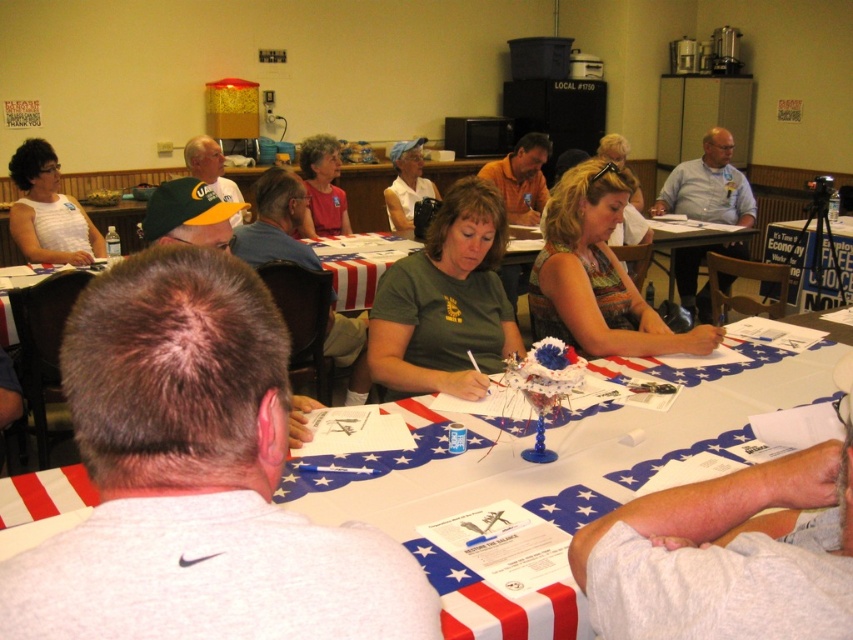
Who is taller, green fabric cap at upper left or matte black camera at center?

matte black camera at center is taller.

Can you confirm if green fabric cap at upper left is taller than matte black camera at center?

No.

This screenshot has height=640, width=853. Identify the location of green fabric cap at upper left. [x=189, y=214].

Image resolution: width=853 pixels, height=640 pixels. I want to click on white paper with patriotic design at center, so click(x=556, y=468).

Is white paper with patriotic design at center taller than gray shirt at center?

In fact, white paper with patriotic design at center may be shorter than gray shirt at center.

Image resolution: width=853 pixels, height=640 pixels. What do you see at coordinates (556, 468) in the screenshot?
I see `white paper with patriotic design at center` at bounding box center [556, 468].

Locate an element on the screen. white paper with patriotic design at center is located at coordinates (556, 468).

Between matte red shirt at center and matte black camera at center, which one has less height?

Standing shorter between the two is matte red shirt at center.

Does matte red shirt at center appear under matte black camera at center?

Yes, matte red shirt at center is below matte black camera at center.

You are a GUI agent. You are given a task and a screenshot of the screen. Output one action in this format:
    pyautogui.click(x=<x>, y=<y>)
    Task: Click on the matte red shirt at center
    The height and width of the screenshot is (640, 853).
    Given the screenshot: What is the action you would take?
    pyautogui.click(x=322, y=188)